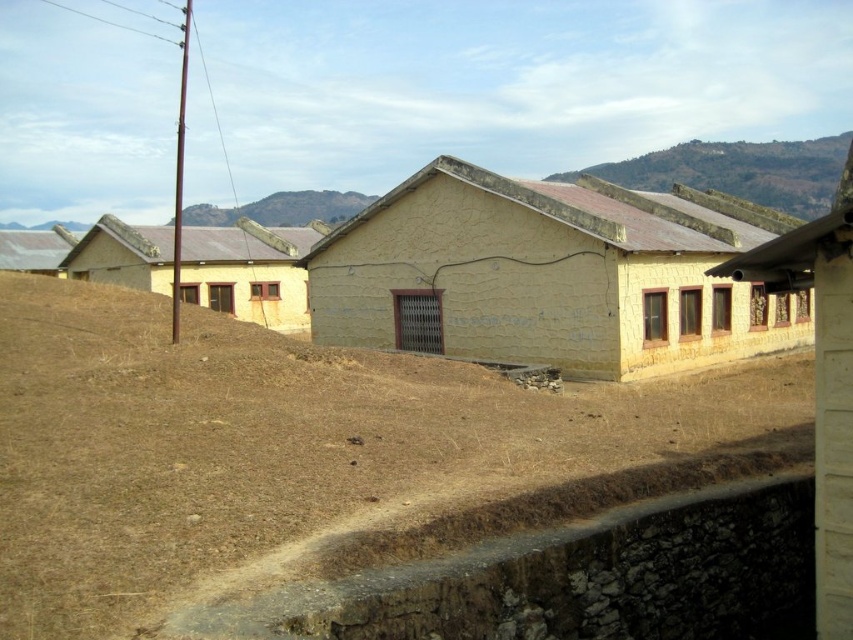
Question: Estimate the real-world distances between objects in this image. Which object is farther from the metallic corrugated roof at left?

Choices:
 (A) matte yellow building at center
 (B) brown rocky hill at upper center
 (C) yellow matte building at center

Answer: (B)

Question: Does yellow matte building at center have a smaller size compared to brown rocky hill at upper center?

Choices:
 (A) no
 (B) yes

Answer: (A)

Question: Observing the image, what is the correct spatial positioning of matte yellow building at center in reference to brown rocky hill at upper center?

Choices:
 (A) above
 (B) below

Answer: (B)

Question: Which object is the closest to the matte yellow building at center?

Choices:
 (A) metallic corrugated roof at left
 (B) brown rocky hill at upper center
 (C) yellow matte building at center

Answer: (C)

Question: Which object is positioned farthest from the brown soil at center?

Choices:
 (A) metallic corrugated roof at left
 (B) matte yellow building at center
 (C) yellow matte building at center

Answer: (A)

Question: In this image, where is matte yellow building at center located relative to brown rocky hill at upper center?

Choices:
 (A) right
 (B) left

Answer: (A)